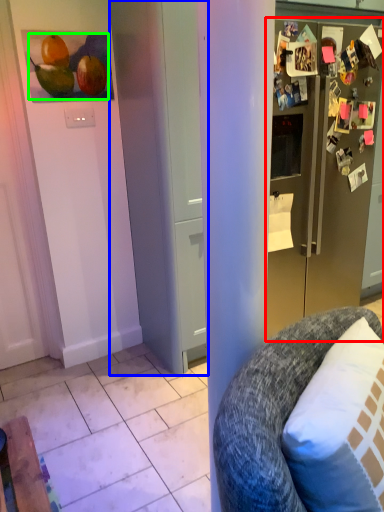
Question: Which object is the closest to the refrigerator (highlighted by a red box)? Choose among these: door (highlighted by a blue box) or fruit (highlighted by a green box).

Choices:
 (A) door
 (B) fruit

Answer: (A)